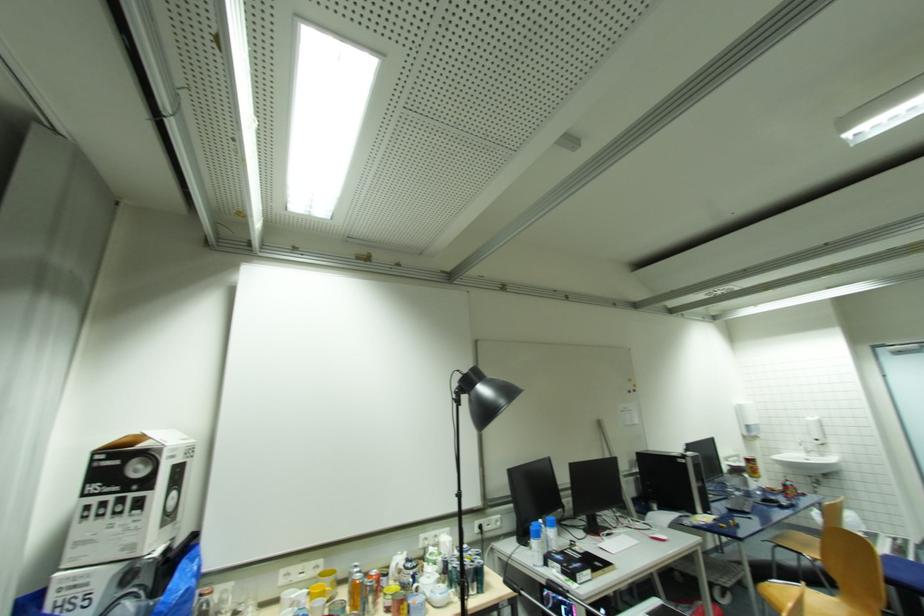
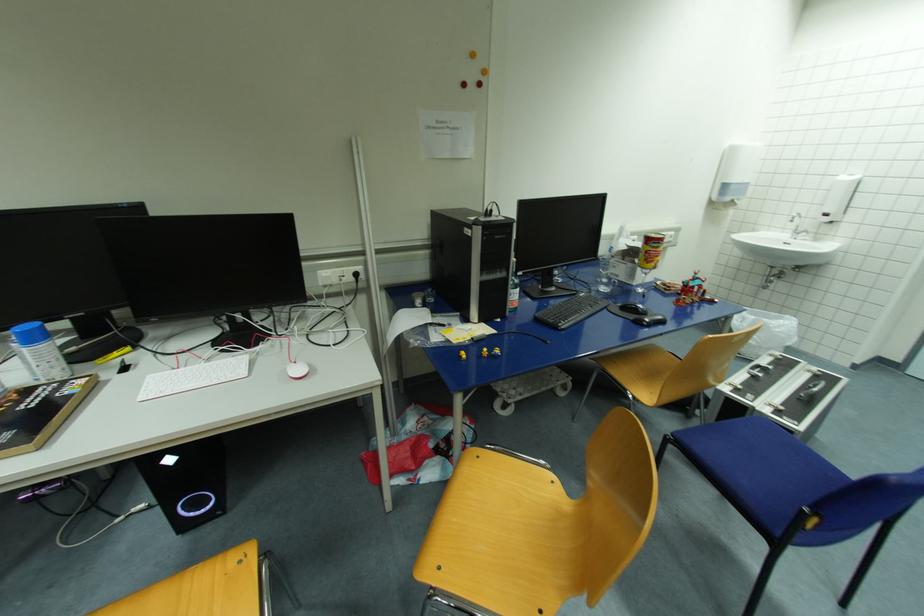
Find the pixel in the second image that matches pixel 754 461 in the first image.

(653, 241)